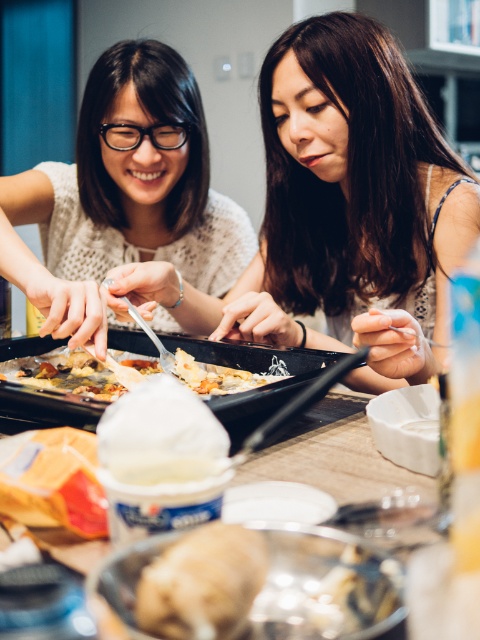
Question: Which of these objects is positioned farthest from the matte black tray at center?

Choices:
 (A) golden crispy pastry at center
 (B) brown crumbly bread at lower center

Answer: (B)

Question: Considering the relative positions of matte black tray at center and white matte plate at center in the image provided, where is matte black tray at center located with respect to white matte plate at center?

Choices:
 (A) above
 (B) below

Answer: (A)

Question: Does matte white shirt at left have a greater width compared to brown crumbly bread at lower center?

Choices:
 (A) yes
 (B) no

Answer: (A)

Question: Is black non-stick tray at center to the right of golden crispy pastry at center from the viewer's perspective?

Choices:
 (A) no
 (B) yes

Answer: (B)

Question: Estimate the real-world distances between objects in this image. Which object is farther from the black non-stick tray at center?

Choices:
 (A) matte white shirt at left
 (B) matte black tray at center
 (C) white matte plate at center
 (D) brown crumbly bread at lower center

Answer: (D)

Question: Which point is closer to the camera?

Choices:
 (A) (64, 326)
 (B) (452, 244)
 (C) (227, 618)
 (D) (60, 401)

Answer: (C)